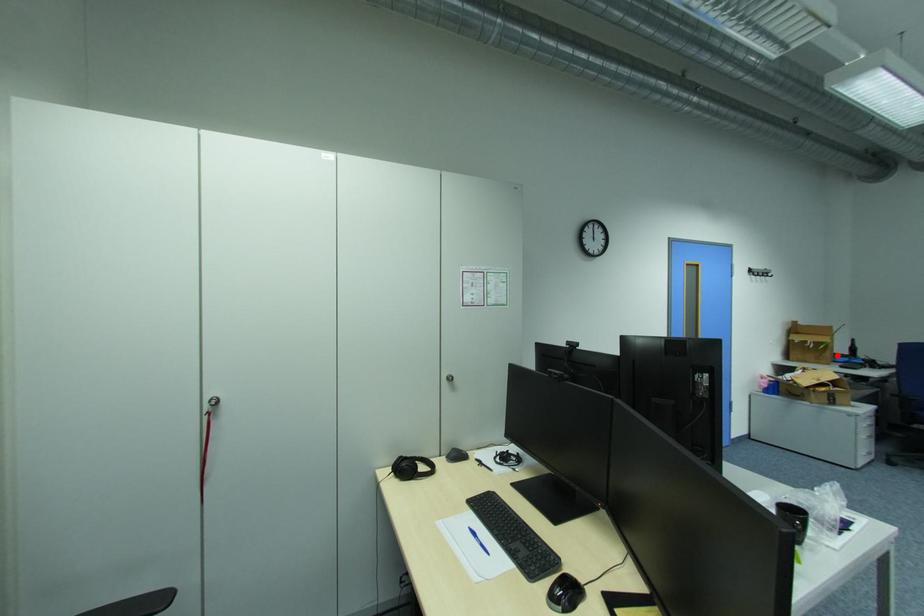
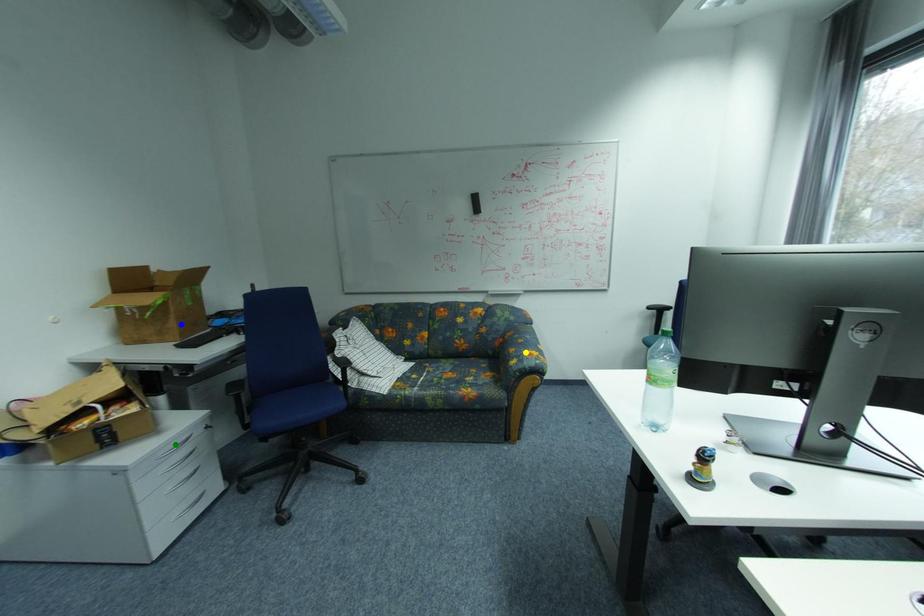
Question: I am providing you with two images of the same scene from different viewpoints. A red point is marked on the first image. You are given multiple points on the second image. Which spot in image 2 lines up with the point in image 1?

Choices:
 (A) yellow point
 (B) green point
 (C) blue point

Answer: (C)